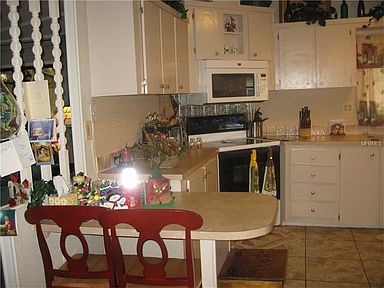
At what (x,y) coordinates should I click in order to perform the action: click on kitchen curtain. Please return your answer as a coordinate pair (x, y). This screenshot has width=384, height=288. Looking at the image, I should click on (369, 81).